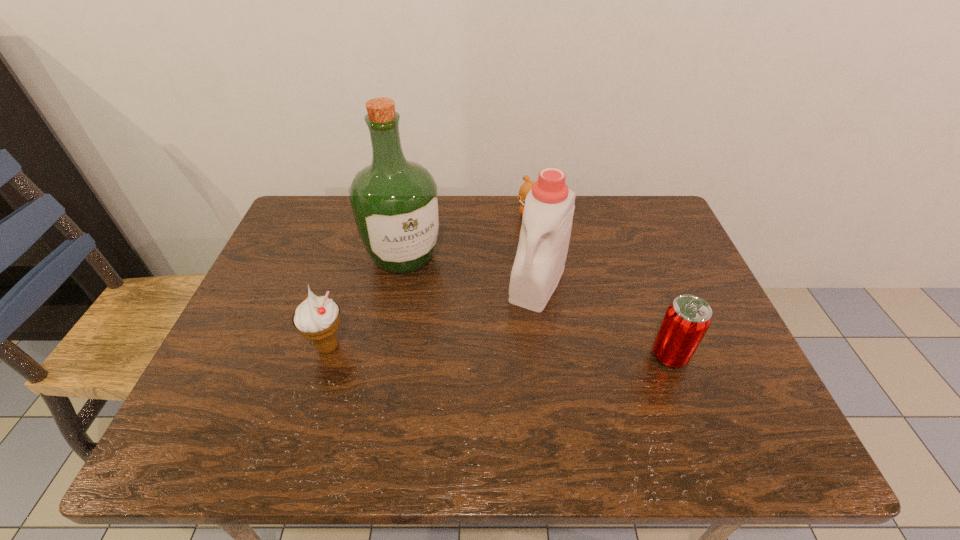
In the image, there is a desktop. Where is `vacant space at the far edge`? The height and width of the screenshot is (540, 960). vacant space at the far edge is located at coordinates (511, 201).

Identify the location of free space at the near edge of the desktop. This screenshot has height=540, width=960. (428, 375).

You are a GUI agent. You are given a task and a screenshot of the screen. Output one action in this format:
    pyautogui.click(x=<x>, y=<y>)
    Task: Click on the free space at the left edge of the desktop
    This screenshot has width=960, height=540.
    Given the screenshot: What is the action you would take?
    pyautogui.click(x=264, y=354)

Locate an element on the screen. This screenshot has width=960, height=540. vacant area at the right edge is located at coordinates (674, 291).

I want to click on vacant space at the far left corner, so click(x=320, y=201).

Locate an element on the screen. vacant area between the fourth shortest object and the liquor is located at coordinates pyautogui.click(x=470, y=270).

This screenshot has width=960, height=540. What are the coordinates of `empty location between the icecream and the rightmost object` in the screenshot? It's located at (499, 351).

Locate an element on the screen. This screenshot has width=960, height=540. vacant space in between the icecream and the detergent is located at coordinates (433, 315).

You are a GUI agent. You are given a task and a screenshot of the screen. Output one action in this format:
    pyautogui.click(x=<x>, y=<y>)
    Task: Click on the vacant region between the rightmost object and the fourth shortest object
    
    Given the screenshot: What is the action you would take?
    pyautogui.click(x=604, y=319)

The height and width of the screenshot is (540, 960). Find the location of `vacant space in between the detergent and the tallest object`. vacant space in between the detergent and the tallest object is located at coordinates (470, 270).